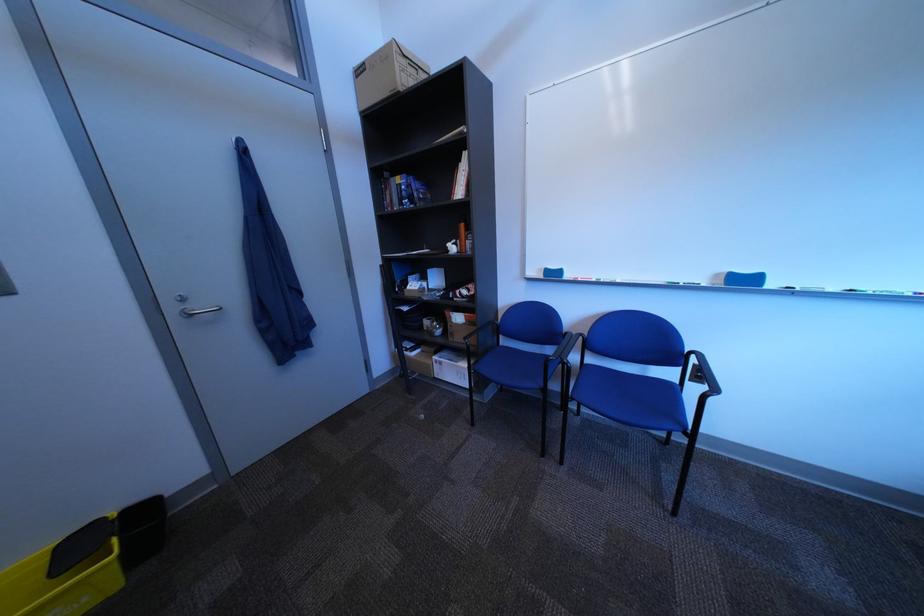
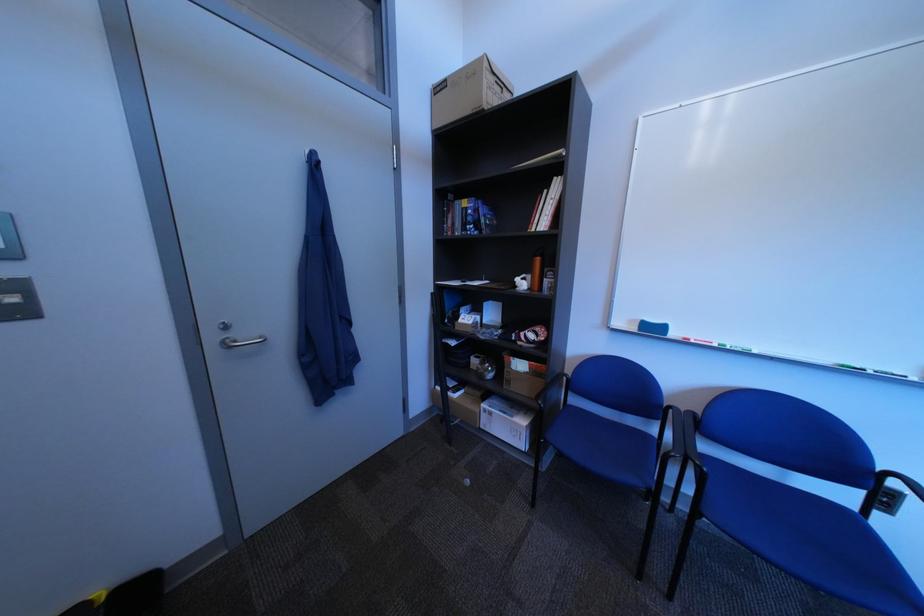
The point at (466, 244) is marked in the first image. Where is the corresponding point in the second image?

(535, 278)